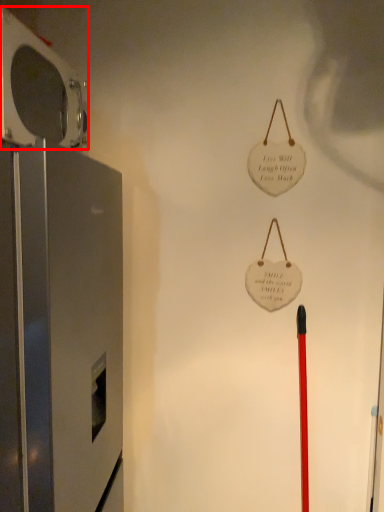
Question: From the image's perspective, considering the relative positions of appliance (annotated by the red box) and appliance in the image provided, where is appliance (annotated by the red box) located with respect to the staircase?

Choices:
 (A) below
 (B) above

Answer: (B)